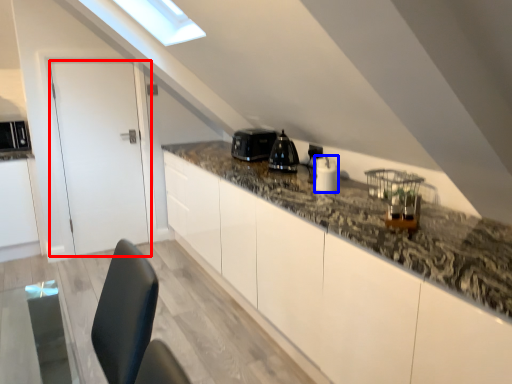
Question: Which object is further to the camera taking this photo, door (highlighted by a red box) or appliance (highlighted by a blue box)?

Choices:
 (A) door
 (B) appliance

Answer: (A)